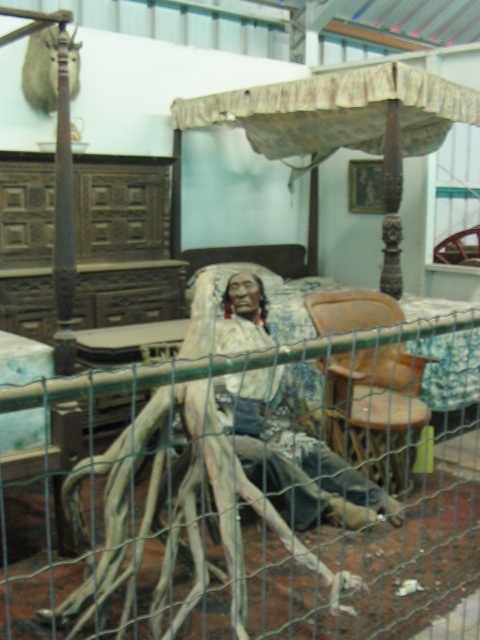
Is green wire mesh at center shorter than matte brown wooden mannequin at center?

Indeed, green wire mesh at center has a lesser height compared to matte brown wooden mannequin at center.

Measure the distance between green wire mesh at center and camera.

They are 1.49 meters apart.

You are a GUI agent. You are given a task and a screenshot of the screen. Output one action in this format:
    pyautogui.click(x=<x>, y=<y>)
    Task: Click on the green wire mesh at center
    The image size is (480, 640).
    Given the screenshot: What is the action you would take?
    pyautogui.click(x=257, y=499)

Does green wire mesh at center have a greater height compared to brown leather chair at center?

Indeed, green wire mesh at center has a greater height compared to brown leather chair at center.

Is point (448, 381) in front of point (330, 316)?

No, it is not.

Is point (444, 385) more distant than point (344, 449)?

Yes, it is.

Identify the location of green wire mesh at center. The height and width of the screenshot is (640, 480). (257, 499).

Measure the distance between green wire mesh at center and wooden canopy bed at center.

The distance of green wire mesh at center from wooden canopy bed at center is 2.36 meters.

Can you confirm if green wire mesh at center is positioned to the left of wooden canopy bed at center?

Correct, you'll find green wire mesh at center to the left of wooden canopy bed at center.

Which is in front, point (84, 384) or point (178, 154)?

Point (84, 384) is in front.

Locate an element on the screen. green wire mesh at center is located at coordinates (257, 499).